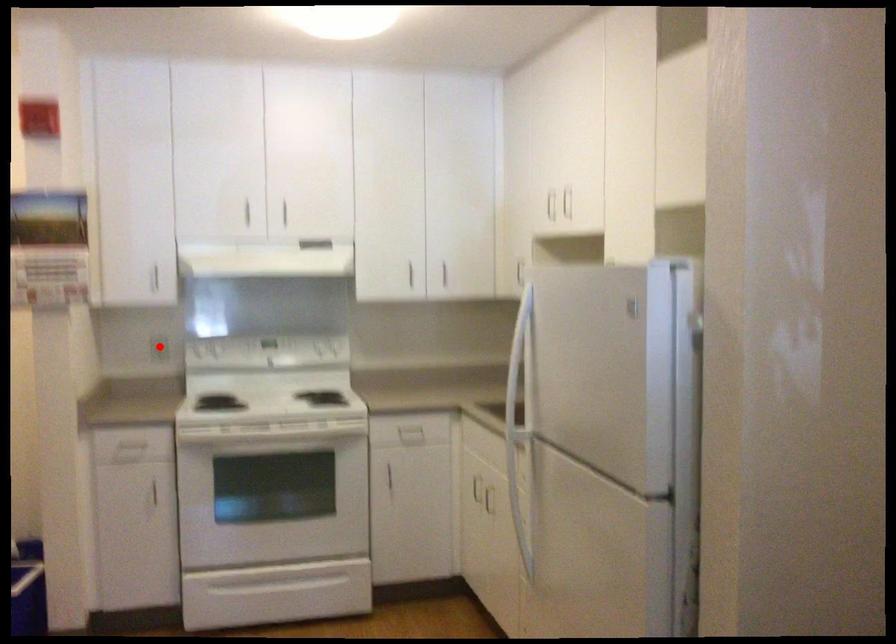
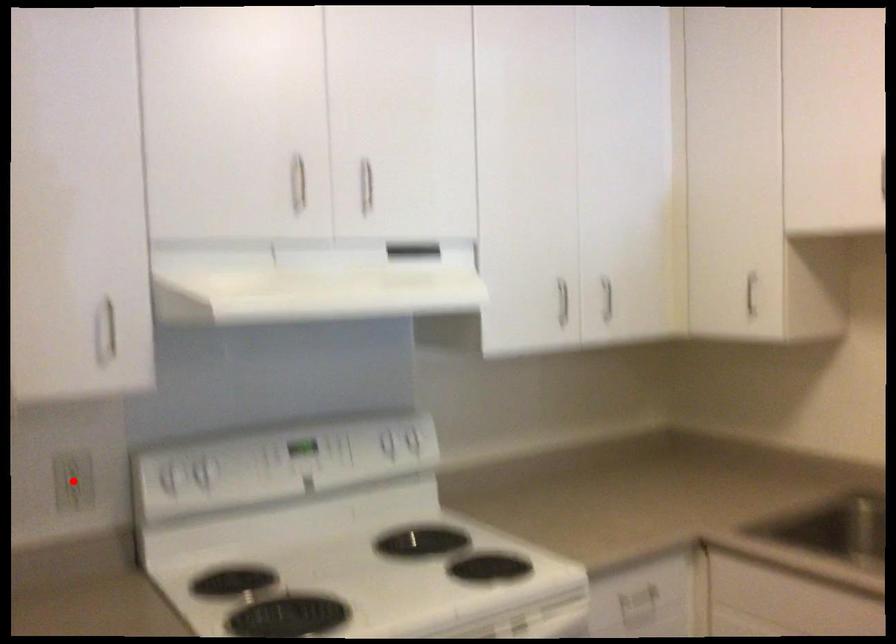
I am providing you with two images of the same scene from different viewpoints. A red point is marked on the first image and another point is marked on the second image. Does the point marked in image1 correspond to the same location as the one in image2?

Yes